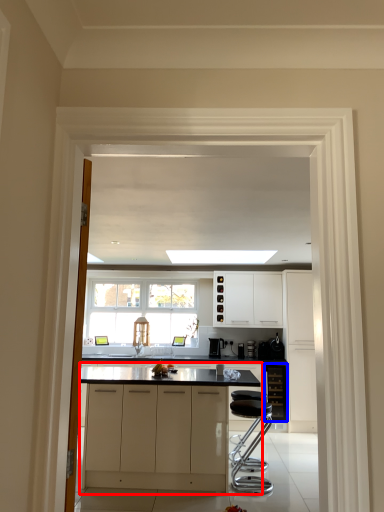
Question: Which of the following is the farthest to the observer, cabinetry (highlighted by a red box) or cabinetry (highlighted by a blue box)?

Choices:
 (A) cabinetry
 (B) cabinetry

Answer: (B)